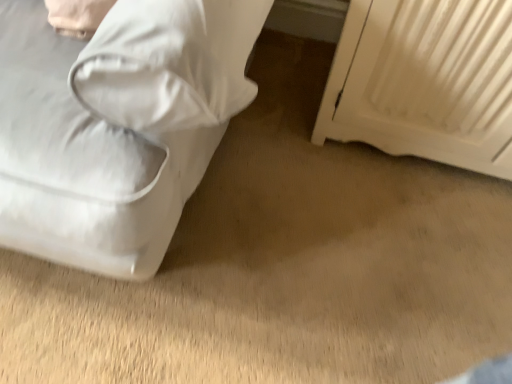
You are a GUI agent. You are given a task and a screenshot of the screen. Output one action in this format:
    pyautogui.click(x=<x>, y=<y>)
    Task: Click on the white fabric pillow at left
    This screenshot has height=384, width=512.
    Given the screenshot: What is the action you would take?
    pyautogui.click(x=170, y=62)

Measure the distance between white fabric pillow at left and camera.

white fabric pillow at left is 52.42 centimeters away from camera.

The height and width of the screenshot is (384, 512). Describe the element at coordinates (170, 62) in the screenshot. I see `white fabric pillow at left` at that location.

Locate an element on the screen. white fabric pillow at left is located at coordinates (170, 62).